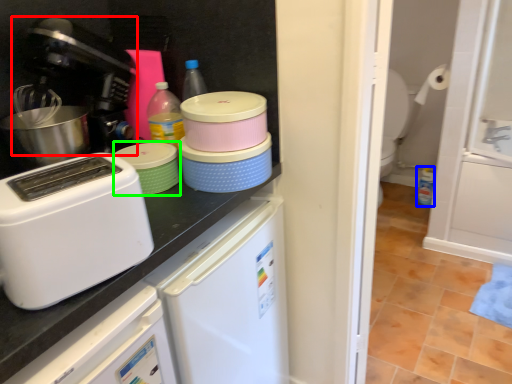
Question: Which object is positioned closest to coffee machine (highlighted by a red box)? Select from bottle (highlighted by a blue box) and appliance (highlighted by a green box).

Choices:
 (A) bottle
 (B) appliance

Answer: (B)